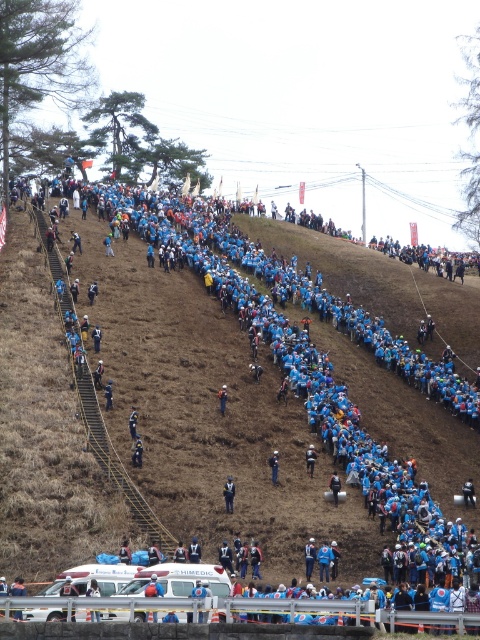
Question: Is blue fabric backpack at center thinner than orange fabric at center?

Choices:
 (A) no
 (B) yes

Answer: (B)

Question: In this image, where is blue fabric person at upper center located relative to blue fabric jacket at center?

Choices:
 (A) below
 (B) above

Answer: (B)

Question: Among these points, which one is farthest from the camera?

Choices:
 (A) (224, 486)
 (B) (402, 557)
 (C) (218, 400)
 (D) (276, 470)

Answer: (C)

Question: Is blue fabric person at upper center bigger than blue fabric backpack at center?

Choices:
 (A) no
 (B) yes

Answer: (B)

Question: Which object is positioned closest to the blue fabric jacket at center?

Choices:
 (A) blue fabric person at upper center
 (B) orange fabric at center
 (C) blue fabric backpack at center

Answer: (C)

Question: Which object is farther from the camera taking this photo?

Choices:
 (A) orange fabric at center
 (B) blue fabric jacket at center

Answer: (A)